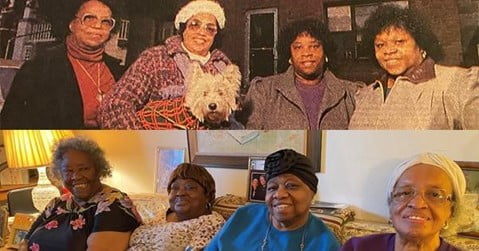
The width and height of the screenshot is (479, 251). I want to click on white painted wall, so tap(365, 161), tap(128, 147).